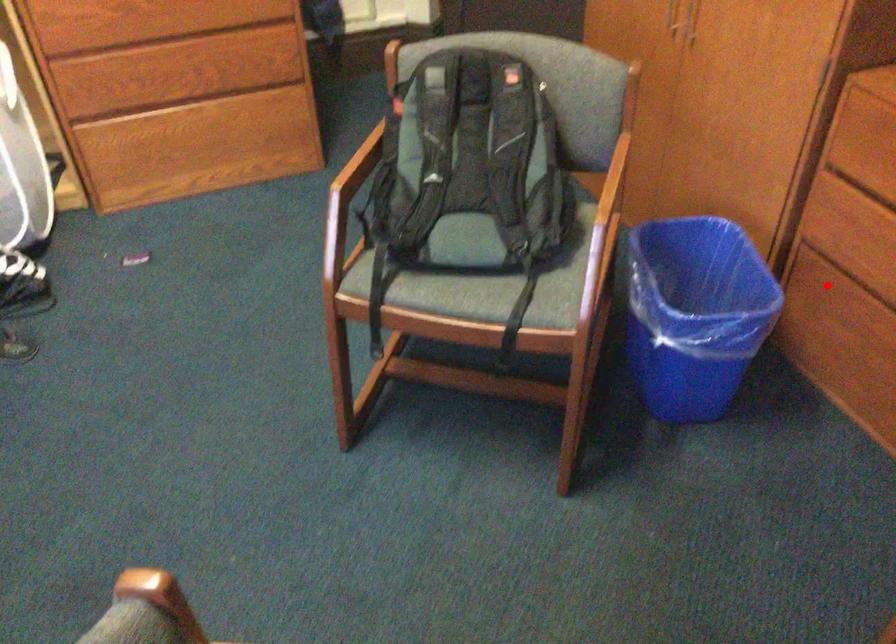
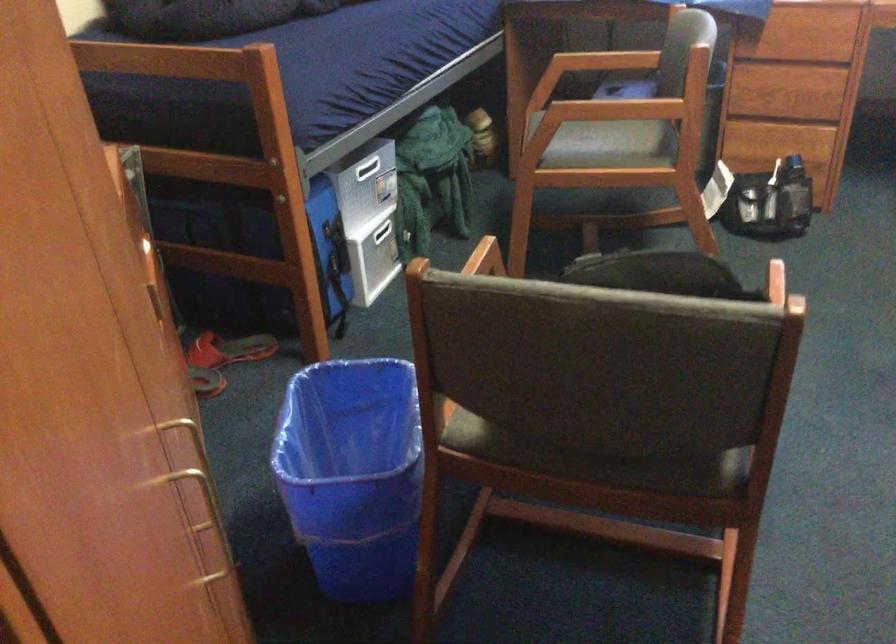
Question: I am providing you with two images of the same scene from different viewpoints. A red point is marked on the first image. Can you still see the location of the red point in image 2?

Choices:
 (A) Yes
 (B) No

Answer: (B)